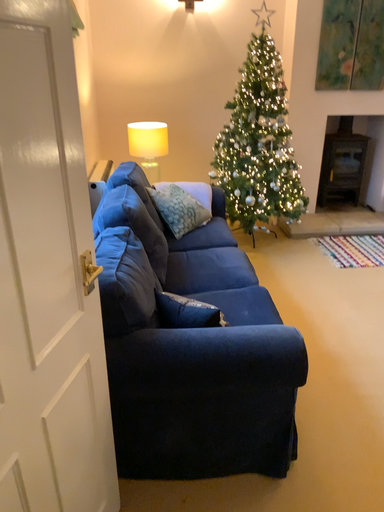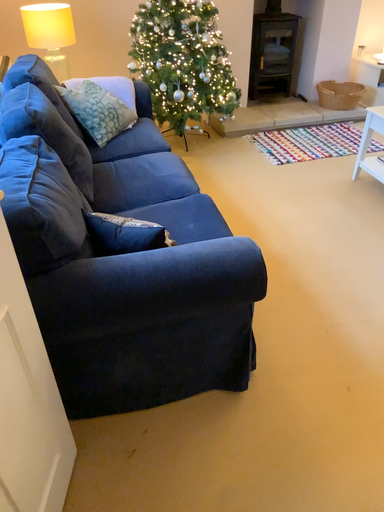
Question: Which way did the camera rotate in the video?

Choices:
 (A) rotated downward
 (B) rotated upward

Answer: (A)